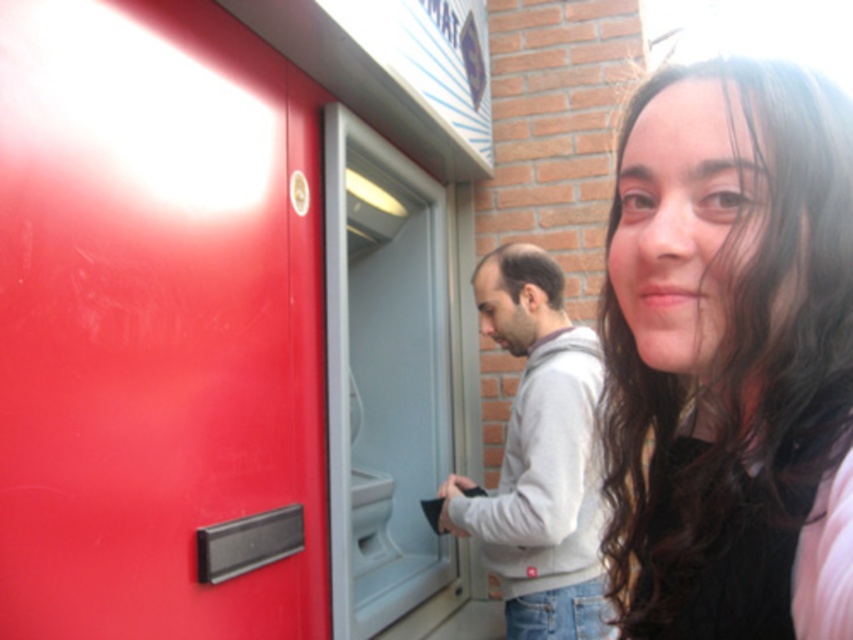
Who is shorter, smooth brown hair at upper right or gray fleece hoodie at center?

Standing shorter between the two is smooth brown hair at upper right.

Between smooth brown hair at upper right and gray fleece hoodie at center, which one has more height?

gray fleece hoodie at center is taller.

Is point (825, 186) positioned before point (595, 529)?

That is True.

Identify the location of smooth brown hair at upper right. The height and width of the screenshot is (640, 853). (730, 355).